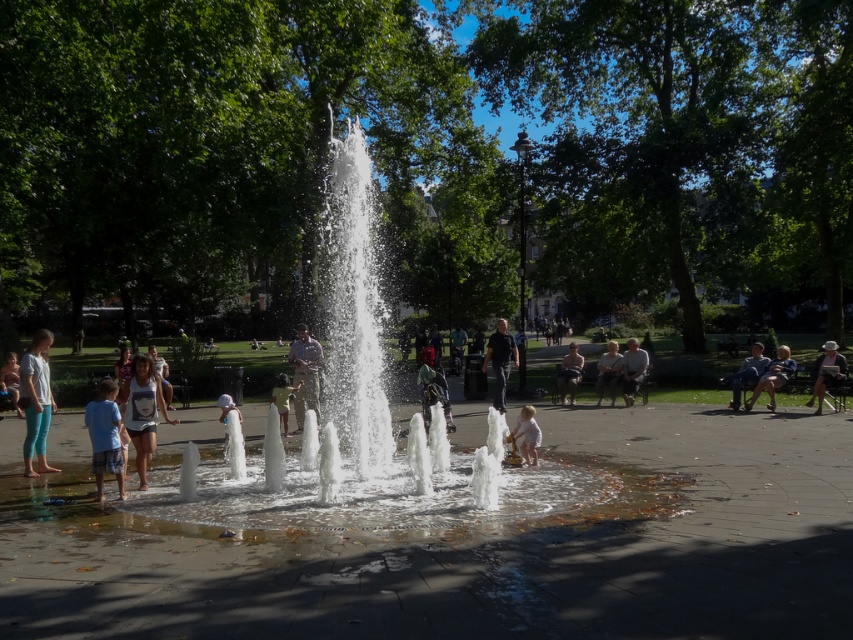
You are a parent at the park and want to ensure your child stays safe near the clear water at center and the light brown wooden bench at right. Considering their heights, which object should the child avoid standing on to prevent slipping?

The clear water at center is much taller than the light brown wooden bench at right, so the child should avoid standing on the clear water at center to prevent slipping.